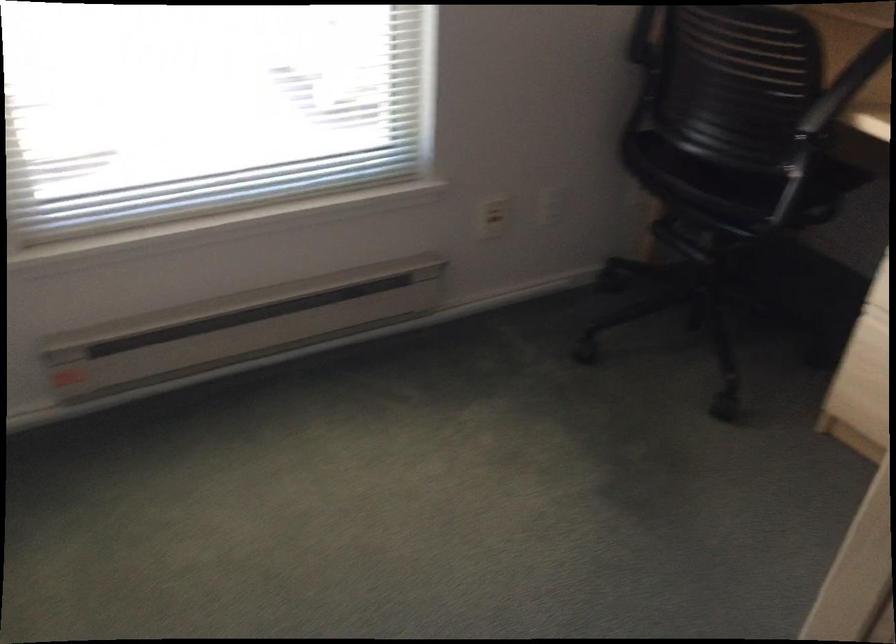
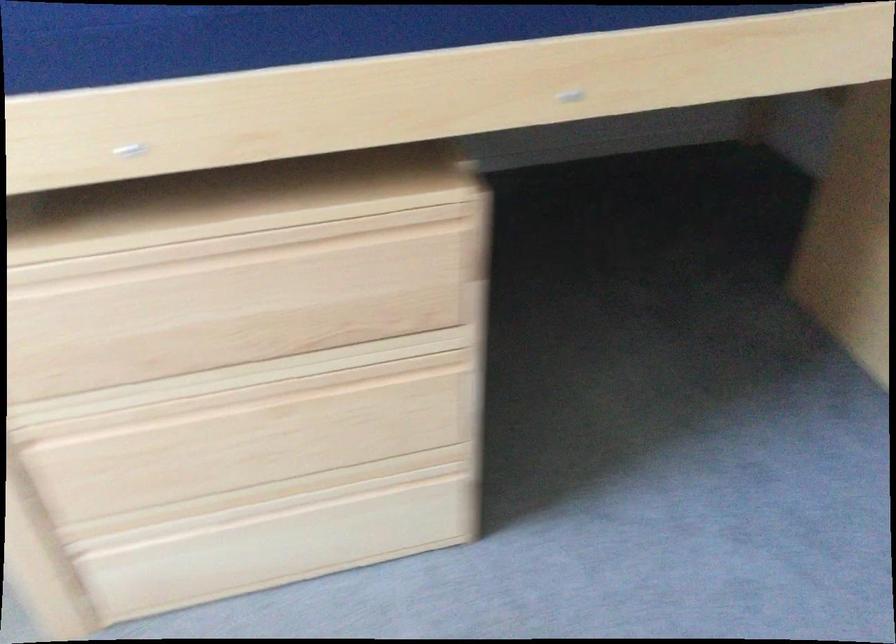
Based on the continuous images, in which direction is the camera rotating?

The camera's rotation is toward right-down.